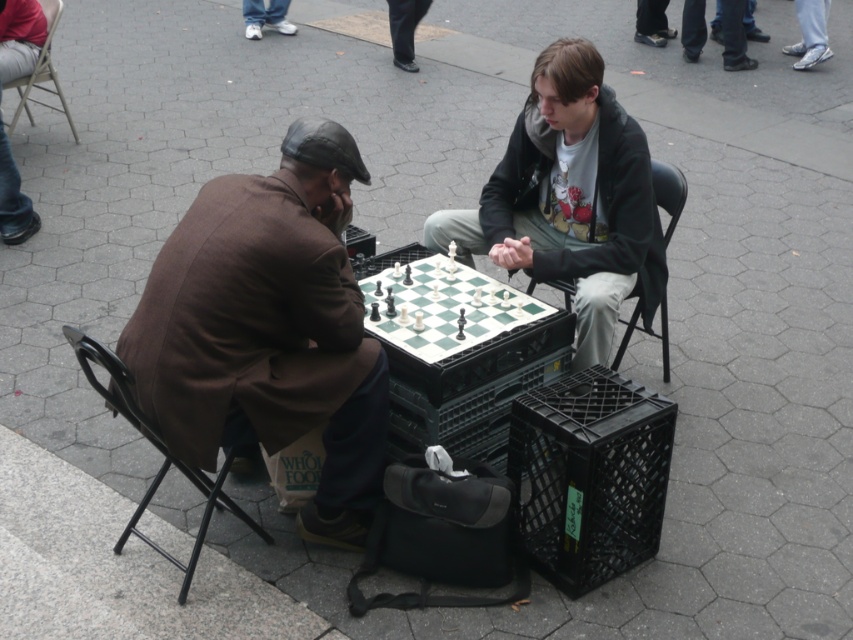
Does white plastic chessboard at center appear on the left side of black plastic chair at center?

Correct, you'll find white plastic chessboard at center to the left of black plastic chair at center.

Is white plastic chessboard at center below black plastic chair at center?

Correct, white plastic chessboard at center is located below black plastic chair at center.

Which is behind, point (428, 307) or point (680, 189)?

Point (680, 189)

Find the location of a particular element. This screenshot has width=853, height=640. white plastic chessboard at center is located at coordinates (439, 304).

Which is in front, point (637, 182) or point (4, 49)?

Point (637, 182) is in front.

Between light gray hoodie at center and jeans at left, which one has more height?

With more height is light gray hoodie at center.

Who is more distant from viewer, (612, 289) or (6, 211)?

The point (6, 211) is behind.

The width and height of the screenshot is (853, 640). What are the coordinates of `light gray hoodie at center` in the screenshot? It's located at (572, 198).

Does point (462, 289) come behind point (51, 90)?

No, (462, 289) is in front of (51, 90).

Does point (415, 298) come in front of point (49, 77)?

Yes, point (415, 298) is in front of point (49, 77).

Between point (370, 288) and point (47, 33), which one is positioned behind?

The point (47, 33) is more distant.

Image resolution: width=853 pixels, height=640 pixels. I want to click on white plastic chessboard at center, so [x=439, y=304].